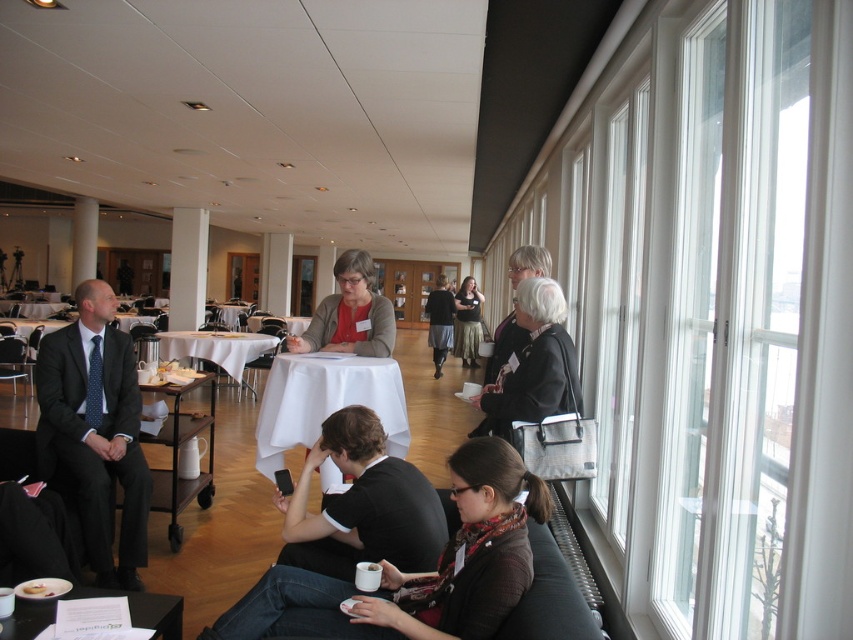
Consider the image. You are organizing a photo shoot and need to arrange two sweaters, the dark gray sweater at center and the matte gray sweater at center, on a shelf. The shelf has a height limit of 1 meter. Can both sweaters be placed on the shelf without exceeding the height limit?

The dark gray sweater at center is taller than the matte gray sweater at center. Since the shelf has a height limit of 1 meter, both sweaters can be placed on the shelf as long as the tallest one, the dark gray sweater at center, does not exceed the 1 meter height limit. However, the exact height of the dark gray sweater at center is not provided, so it depends on its actual measurement.